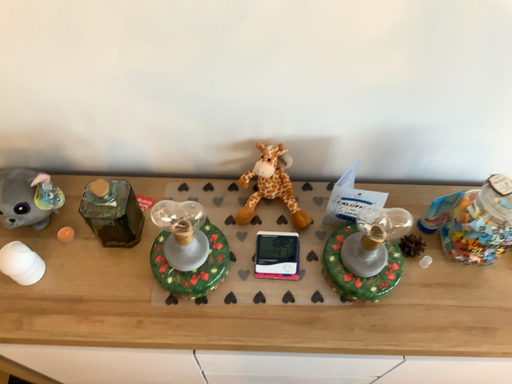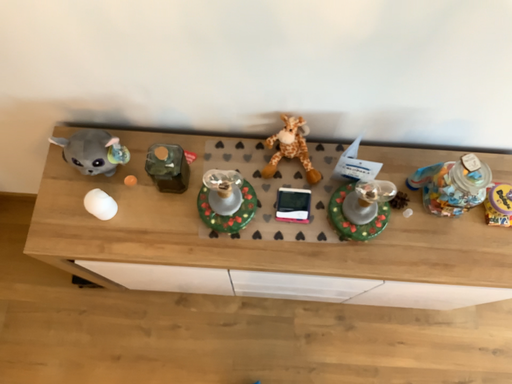
Question: Which way did the camera rotate in the video?

Choices:
 (A) rotated downward
 (B) rotated upward

Answer: (A)